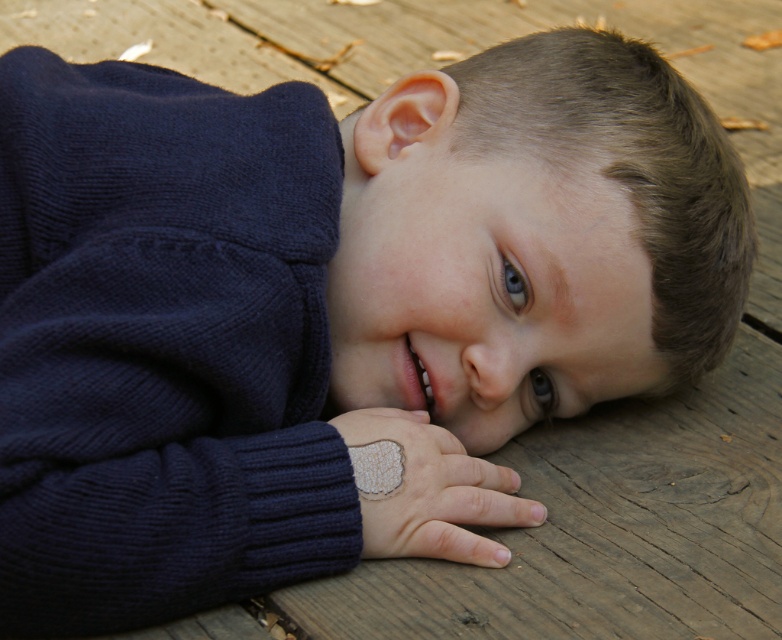
Question: Among these objects, which one is farthest from the camera?

Choices:
 (A) navy blue knitted sweater at left
 (B) white textured fabric at center

Answer: (B)

Question: Which point appears closest to the camera in this image?

Choices:
 (A) (436, 442)
 (B) (260, 288)

Answer: (B)

Question: Can you confirm if navy blue knitted sweater at left is positioned above white textured fabric at center?

Choices:
 (A) no
 (B) yes

Answer: (B)

Question: Does navy blue knitted sweater at left have a larger size compared to white textured fabric at center?

Choices:
 (A) yes
 (B) no

Answer: (A)

Question: Does navy blue knitted sweater at left appear over white textured fabric at center?

Choices:
 (A) no
 (B) yes

Answer: (B)